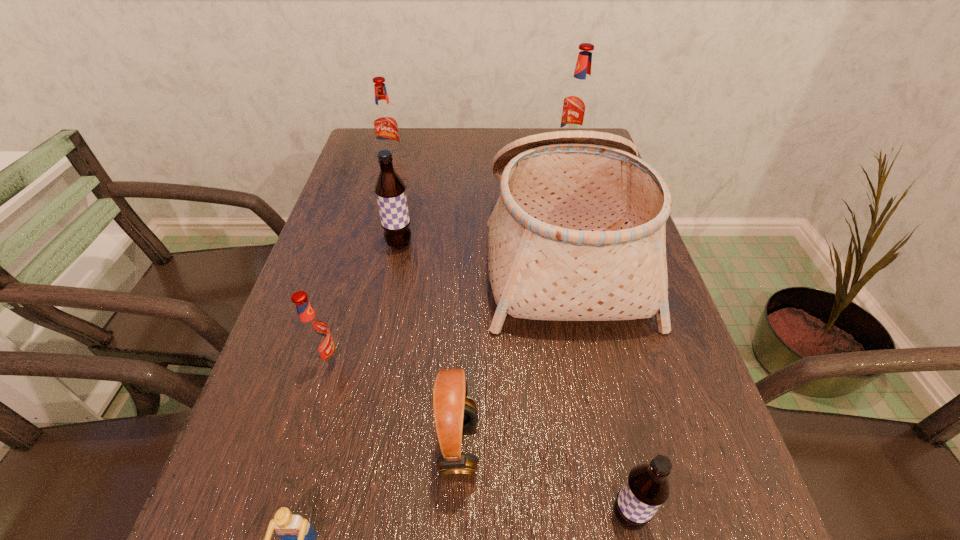
The image size is (960, 540). I want to click on vacant area that satisfies the following two spatial constraints: 1. with the lid open on the basket; 2. on the back side of the smaller brown root beer, so click(616, 517).